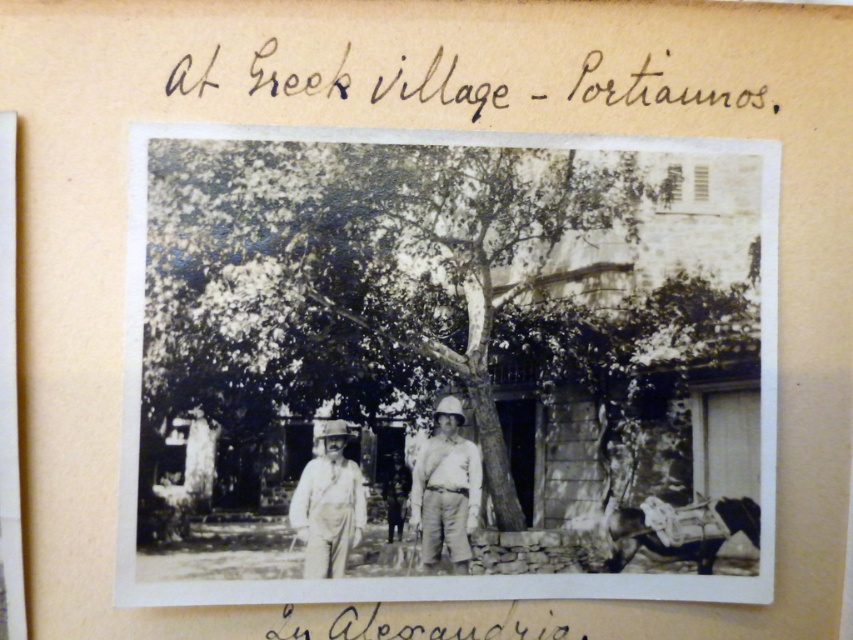
Looking at this image, you are a tailor measuring the distance between two items in the photo for a historical costume exhibit. The items are the smooth khaki shorts at center and the smooth white hat at center. The exhibit requires that the items be displayed with at least 2 inches of space between them. Based on the photo, will the current spacing meet the exhibit requirements?

The distance between the smooth khaki shorts at center and the smooth white hat at center is 2.25 inches, which exceeds the required 2 inches. Therefore, the current spacing meets the exhibit requirements.

You are an archaeologist examining this old photograph from Portiaunos. You notice the smooth white hat at center. Based on its position, can you determine if it is closer to the top or bottom edge of the image?

The smooth white hat at center is located at point (x=328, y=504), which means it is closer to the bottom edge of the image since the y coordinate is lower.

You are a photographer in the village of Portiaunos trying to capture a closeup shot of the smooth white hat at center. However, there is an obstruction caused by the smooth khaki shorts at center. Can you still take the photo without moving the obstruction?

The smooth khaki shorts at center is further to the viewer than smooth white hat at center, so the smooth khaki shorts at center is blocking the view of the smooth white hat at center. Therefore, you cannot take the photo without moving the obstruction.